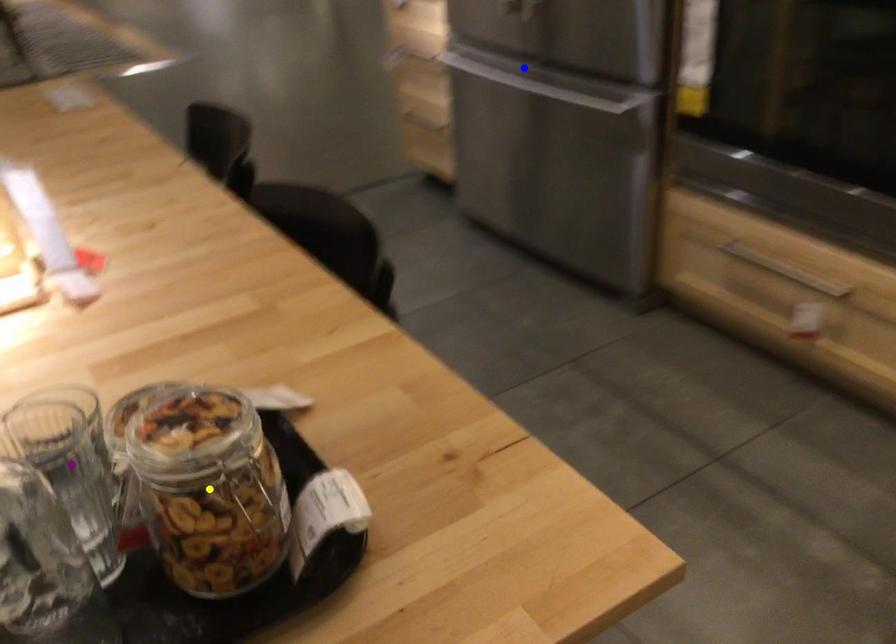
Order these from nearest to farthest:
blue point
purple point
yellow point

1. yellow point
2. purple point
3. blue point